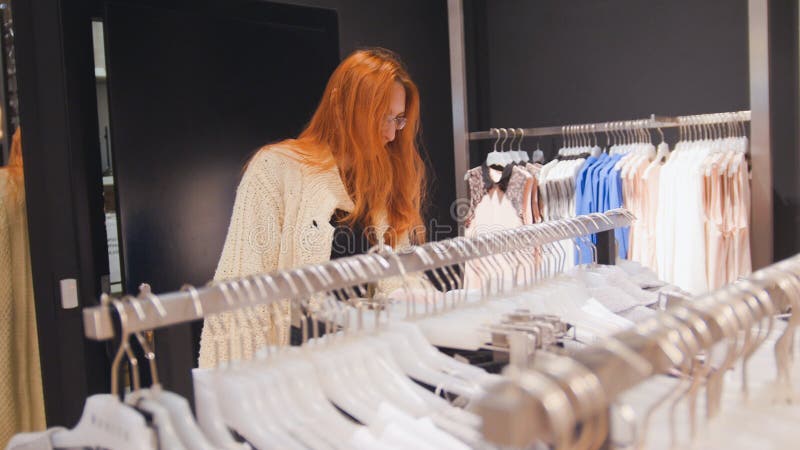
This screenshot has height=450, width=800. I want to click on black background walls, so click(165, 104), click(558, 63).